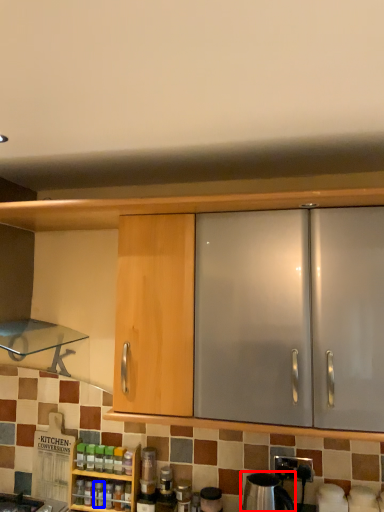
Question: Which point is closer to the camera, appliance (highlighted by a red box) or bottle (highlighted by a blue box)?

Choices:
 (A) appliance
 (B) bottle

Answer: (A)